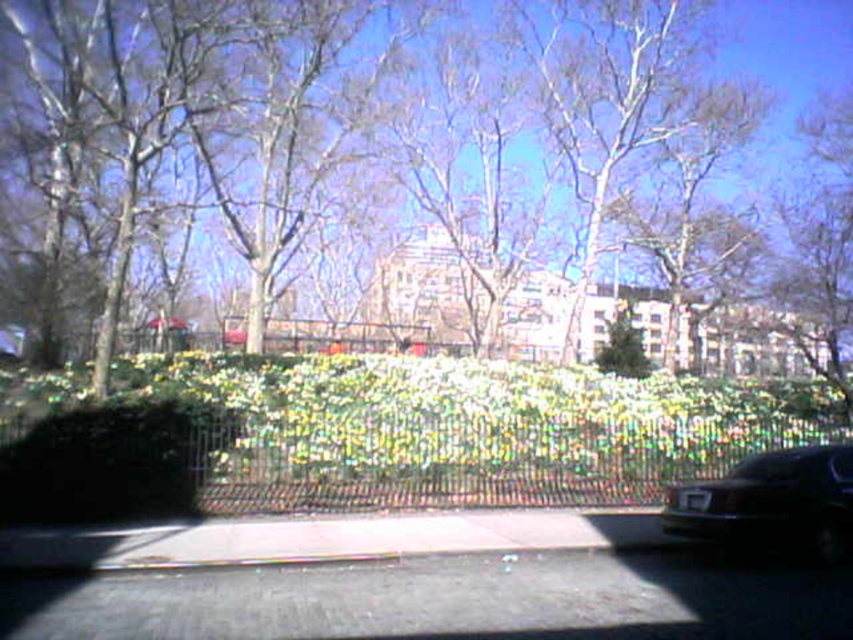
Is smooth bark tree at center further to camera compared to shiny black car at lower right?

Yes, smooth bark tree at center is behind shiny black car at lower right.

Where is `smooth bark tree at center`? The height and width of the screenshot is (640, 853). smooth bark tree at center is located at coordinates point(41,132).

Where is `smooth bark tree at center`? smooth bark tree at center is located at coordinates (41, 132).

Does black metal fence at center appear over shiny black car at lower right?

Actually, black metal fence at center is below shiny black car at lower right.

Can you confirm if black metal fence at center is positioned below shiny black car at lower right?

Yes.

What do you see at coordinates (479, 460) in the screenshot?
I see `black metal fence at center` at bounding box center [479, 460].

Find the location of a particular element. This screenshot has height=640, width=853. black metal fence at center is located at coordinates (479, 460).

Which is in front, point (62, 99) or point (601, 369)?

Point (62, 99)

Can you confirm if smooth bark tree at center is thinner than green leafy bush at center?

In fact, smooth bark tree at center might be wider than green leafy bush at center.

This screenshot has height=640, width=853. What do you see at coordinates (41, 132) in the screenshot?
I see `smooth bark tree at center` at bounding box center [41, 132].

Image resolution: width=853 pixels, height=640 pixels. I want to click on smooth bark tree at center, so click(x=41, y=132).